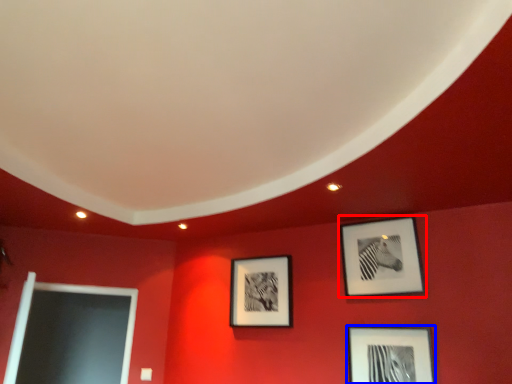
Question: Which of the following is the farthest to the observer, picture frame (highlighted by a red box) or picture frame (highlighted by a blue box)?

Choices:
 (A) picture frame
 (B) picture frame

Answer: (A)